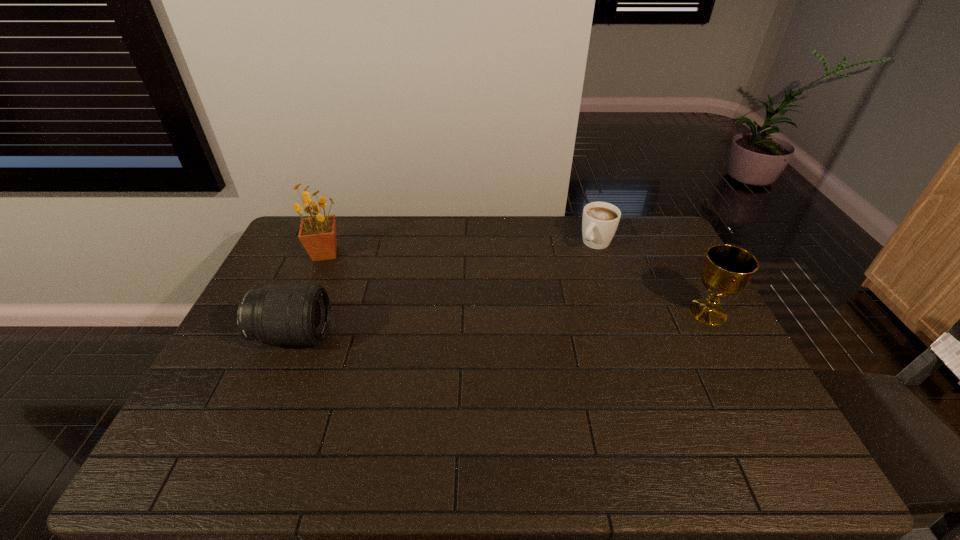
This screenshot has width=960, height=540. What are the coordinates of `empty space that is in between the rightmost object and the second object from right to left` in the screenshot? It's located at [x=652, y=278].

Locate an element on the screen. Image resolution: width=960 pixels, height=540 pixels. free space between the shortest object and the second shortest object is located at coordinates (444, 289).

The height and width of the screenshot is (540, 960). Find the location of `empty space that is in between the second tallest object and the shortest object`. empty space that is in between the second tallest object and the shortest object is located at coordinates (652, 278).

The width and height of the screenshot is (960, 540). Find the location of `object that stands as the second closest to the telephoto lens`. object that stands as the second closest to the telephoto lens is located at coordinates (600, 220).

At what (x,y) coordinates should I click in order to perform the action: click on the closest object to the telephoto lens. Please return your answer as a coordinate pair (x, y). The width and height of the screenshot is (960, 540). Looking at the image, I should click on 317,233.

Where is `blank space that satisfies the following two spatial constraints: 1. on the front side of the chalice; 2. on the left side of the sunflower`? blank space that satisfies the following two spatial constraints: 1. on the front side of the chalice; 2. on the left side of the sunflower is located at coordinates (300, 312).

The width and height of the screenshot is (960, 540). I want to click on free location that satisfies the following two spatial constraints: 1. on the back side of the shortest object; 2. on the left side of the tallest object, so click(x=329, y=243).